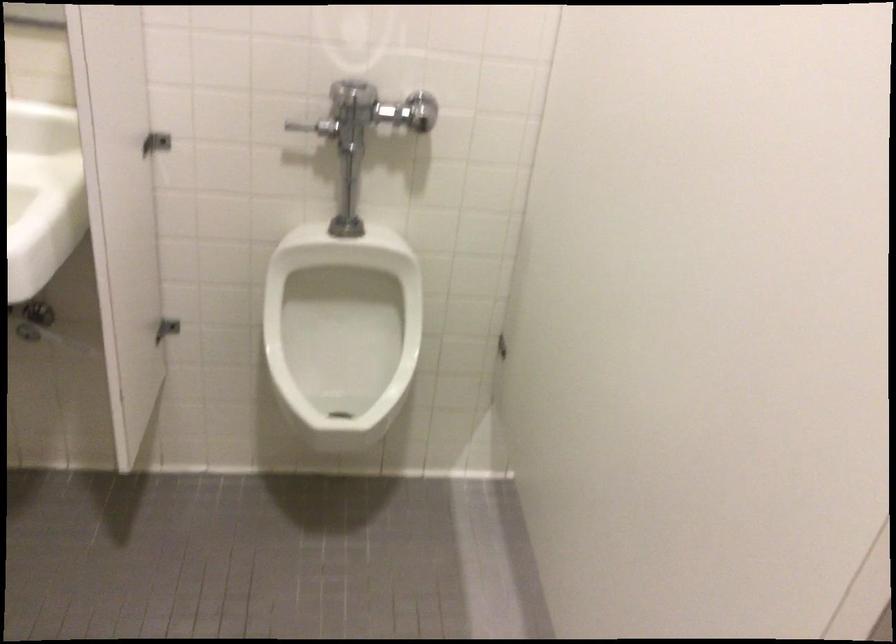
At what (x,y) coordinates should I click in order to perform the action: click on urinal flush handle. Please return your answer as a coordinate pair (x, y). The height and width of the screenshot is (644, 896). Looking at the image, I should click on (323, 127).